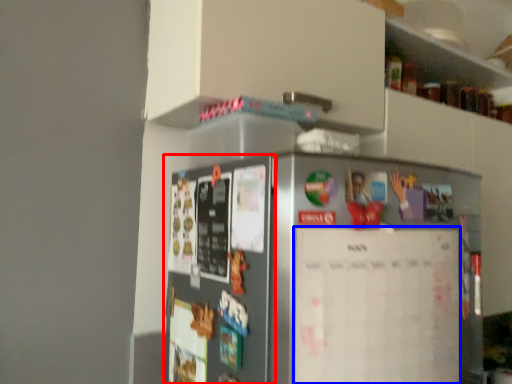
Question: Which object is further to the camera taking this photo, fridge (highlighted by a red box) or bulletin board (highlighted by a blue box)?

Choices:
 (A) fridge
 (B) bulletin board

Answer: (B)